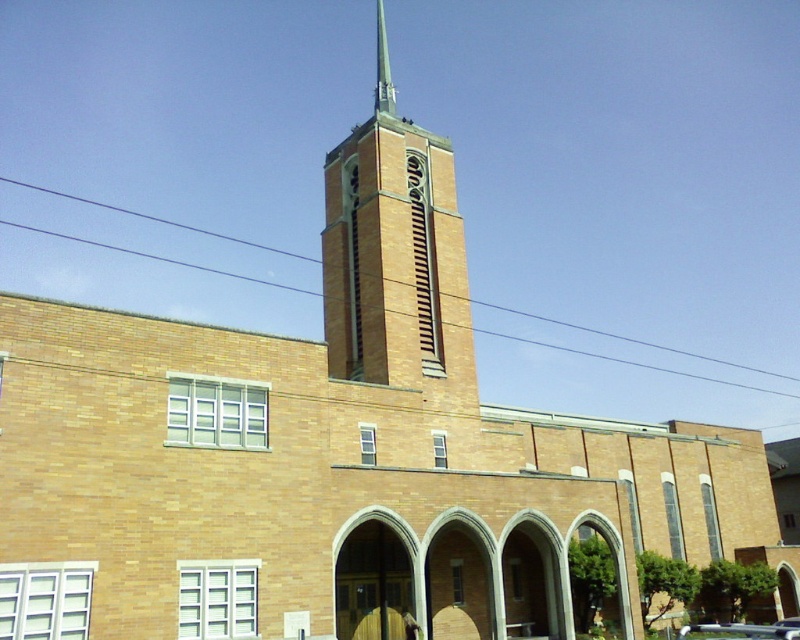
Is brown brick tower at center above green metallic spire at center top?

No.

Does brown brick tower at center have a greater width compared to green metallic spire at center top?

Yes.

Locate an element on the screen. The height and width of the screenshot is (640, 800). brown brick tower at center is located at coordinates (396, 260).

Does metallic silver car at lower right have a greater width compared to green metallic spire at center top?

Incorrect, metallic silver car at lower right's width does not surpass green metallic spire at center top's.

Does metallic silver car at lower right have a lesser height compared to green metallic spire at center top?

Correct, metallic silver car at lower right is not as tall as green metallic spire at center top.

The height and width of the screenshot is (640, 800). What are the coordinates of `metallic silver car at lower right` in the screenshot? It's located at (745, 628).

Can you confirm if brown brick tower at center is positioned to the left of metallic silver car at lower right?

Correct, you'll find brown brick tower at center to the left of metallic silver car at lower right.

Is brown brick tower at center thinner than metallic silver car at lower right?

In fact, brown brick tower at center might be wider than metallic silver car at lower right.

What do you see at coordinates (396, 260) in the screenshot?
I see `brown brick tower at center` at bounding box center [396, 260].

Where is `brown brick tower at center`? Image resolution: width=800 pixels, height=640 pixels. brown brick tower at center is located at coordinates (396, 260).